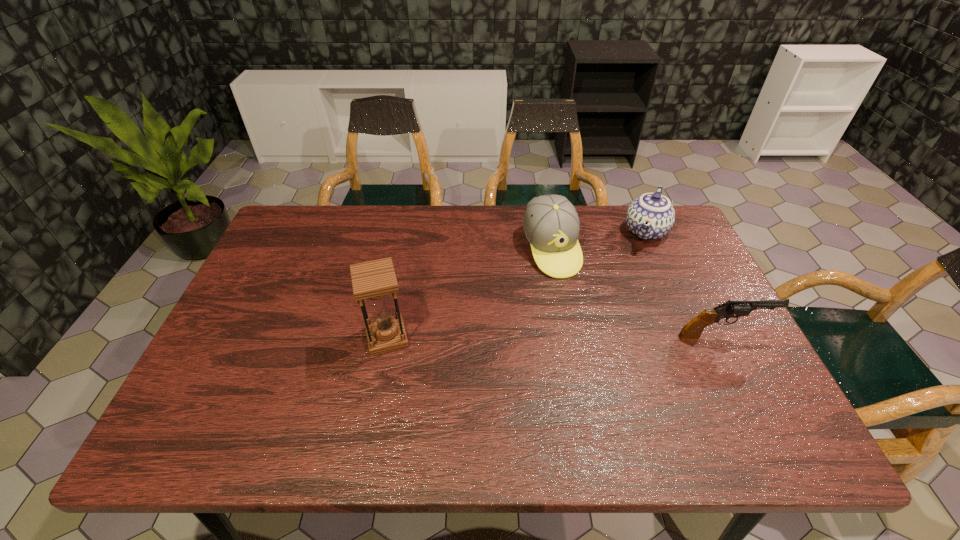
The width and height of the screenshot is (960, 540). I want to click on free spot located 0.180m from the spout of the chinaware, so point(626,287).

Where is `free spot located 0.150m from the spout of the chinaware`? This screenshot has height=540, width=960. free spot located 0.150m from the spout of the chinaware is located at coordinates (629, 281).

The image size is (960, 540). What are the coordinates of `baseball cap present at the far edge` in the screenshot? It's located at (551, 224).

At what (x,y) coordinates should I click in order to perform the action: click on chinaware present at the far edge. Please return your answer as a coordinate pair (x, y). Image resolution: width=960 pixels, height=540 pixels. Looking at the image, I should click on (651, 216).

Locate an element on the screen. Image resolution: width=960 pixels, height=540 pixels. gun located in the right edge section of the desktop is located at coordinates (693, 329).

The image size is (960, 540). I want to click on chinaware that is at the right edge, so click(651, 216).

Where is `object that is at the far right corner`? object that is at the far right corner is located at coordinates (651, 216).

In the image, there is a desktop. What are the coordinates of `free space at the far edge` in the screenshot? It's located at (447, 241).

Locate an element on the screen. free space at the near edge is located at coordinates (293, 388).

In the image, there is a desktop. Identify the location of vacant space at the left edge. This screenshot has width=960, height=540. (305, 288).